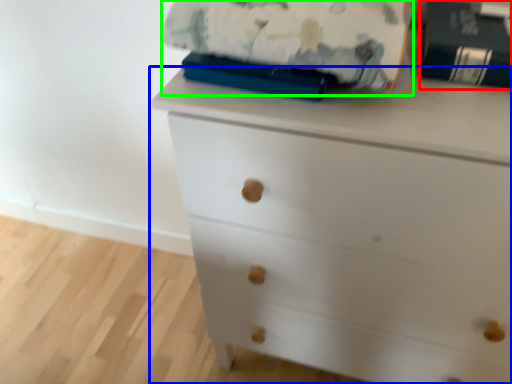
Question: Estimate the real-world distances between objects in this image. Which object is farther from paperback book (highlighted by a red box), chest of drawers (highlighted by a blue box) or blanket (highlighted by a green box)?

Choices:
 (A) chest of drawers
 (B) blanket

Answer: (A)